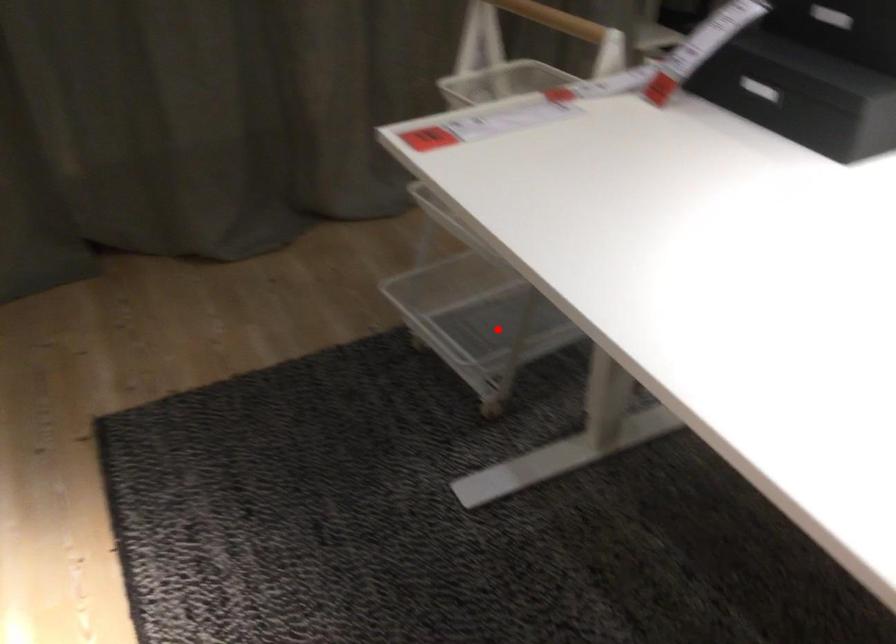
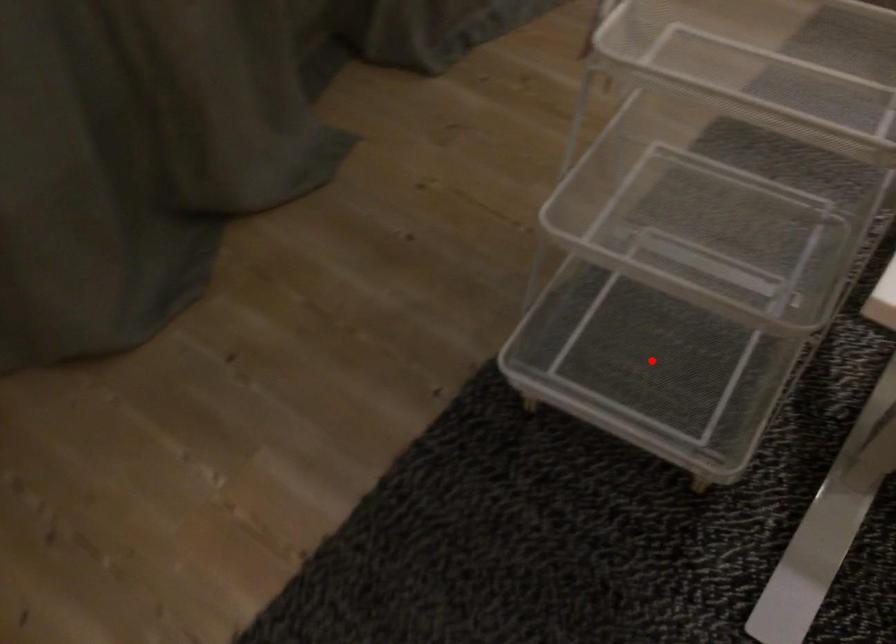
I am providing you with two images of the same scene from different viewpoints. A red point is marked on the first image and another point is marked on the second image. Does the point marked in image1 correspond to the same location as the one in image2?

Yes